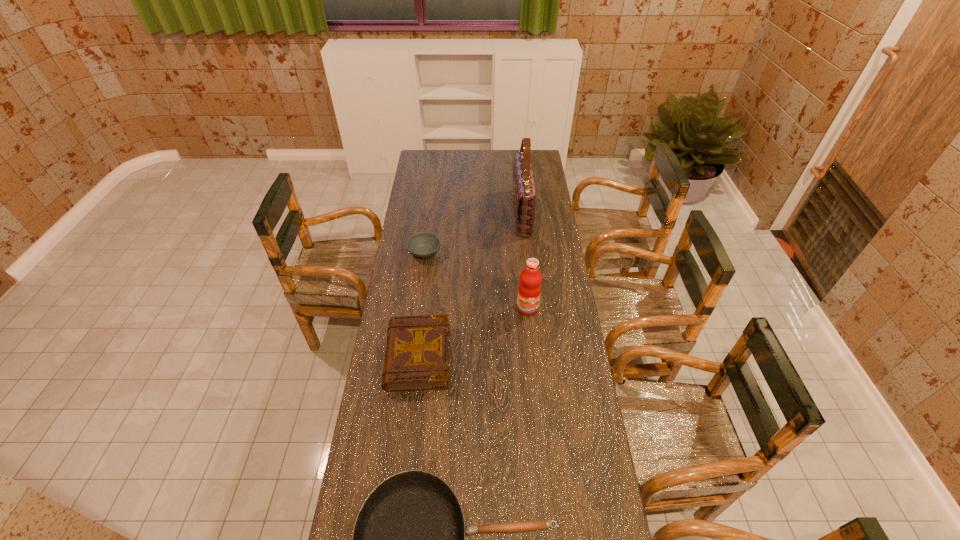
The width and height of the screenshot is (960, 540). In order to click on free point between the third farthest object and the farthest object in this screenshot , I will do `click(524, 260)`.

What are the coordinates of `free spot between the second farthest object and the tallest object` in the screenshot? It's located at (473, 233).

At what (x,y) coordinates should I click in order to perform the action: click on free point between the soup bowl and the third farthest object. Please return your answer as a coordinate pair (x, y). Looking at the image, I should click on (476, 280).

Image resolution: width=960 pixels, height=540 pixels. I want to click on empty space that is in between the soup bowl and the third shortest object, so [x=421, y=304].

Where is `free point between the hardback book and the handbag`? free point between the hardback book and the handbag is located at coordinates (469, 285).

Where is `free spot between the fourth shortest object and the second nearest object`? free spot between the fourth shortest object and the second nearest object is located at coordinates (473, 332).

This screenshot has height=540, width=960. In order to click on object that stands as the second closest to the third nearest object in this screenshot , I will do `click(524, 193)`.

Locate which object is the third closest to the second farthest object. Please provide its 2D coordinates. Your answer should be formatted as a tuple, i.e. [(x, y)], where the tuple contains the x and y coordinates of a point satisfying the conditions above.

[(529, 290)]

Where is `vacant space that satisfies the following two spatial constraints: 1. on the front of the tallest object with the clasp; 2. on the front label of the fruit juice`? The height and width of the screenshot is (540, 960). vacant space that satisfies the following two spatial constraints: 1. on the front of the tallest object with the clasp; 2. on the front label of the fruit juice is located at coordinates (532, 308).

Where is `free point that satisfies the following two spatial constraints: 1. on the front of the handbag with the clasp; 2. on the front label of the third nearest object`? free point that satisfies the following two spatial constraints: 1. on the front of the handbag with the clasp; 2. on the front label of the third nearest object is located at coordinates (532, 308).